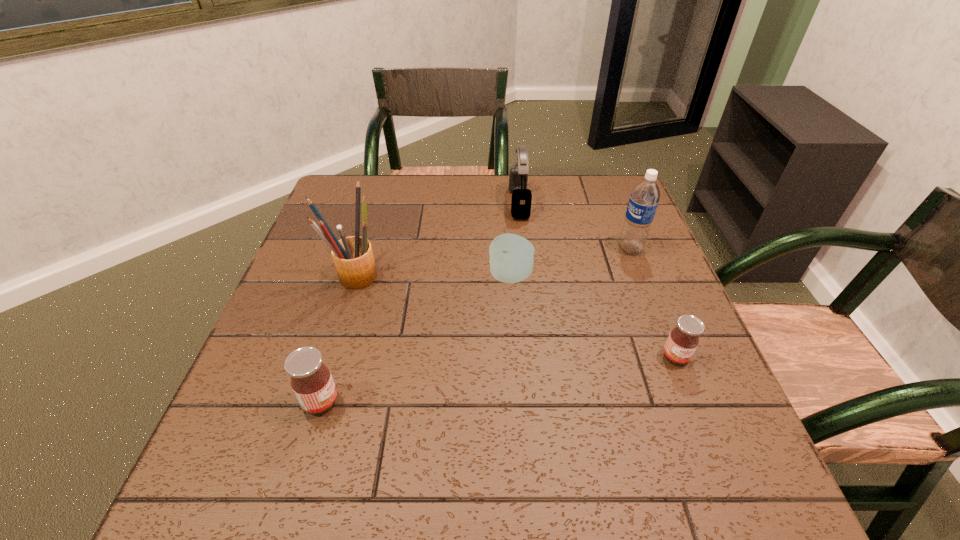
The width and height of the screenshot is (960, 540). I want to click on the nearest object, so click(x=311, y=380).

Find the location of a particular element. The width and height of the screenshot is (960, 540). the left jam is located at coordinates (311, 380).

Find the location of a particular element. This screenshot has width=960, height=540. the farther jam is located at coordinates (683, 340).

You are a GUI agent. You are given a task and a screenshot of the screen. Output one action in this format:
    pyautogui.click(x=<x>, y=<y>)
    Task: Click on the shorter jam
    This screenshot has width=960, height=540.
    Given the screenshot: What is the action you would take?
    pyautogui.click(x=683, y=340)

Locate an element on the screen. This screenshot has height=540, width=960. headset is located at coordinates (521, 200).

Locate an element on the screen. the third tallest object is located at coordinates (521, 200).

Identify the location of apple. This screenshot has width=960, height=540. (511, 260).

Image resolution: width=960 pixels, height=540 pixels. Find the location of `pencil box`. pencil box is located at coordinates (353, 257).

The height and width of the screenshot is (540, 960). What are the coordinates of `water bottle` in the screenshot? It's located at (644, 198).

Locate an element on the screen. vacant point located on the label side of the taller jam is located at coordinates (490, 401).